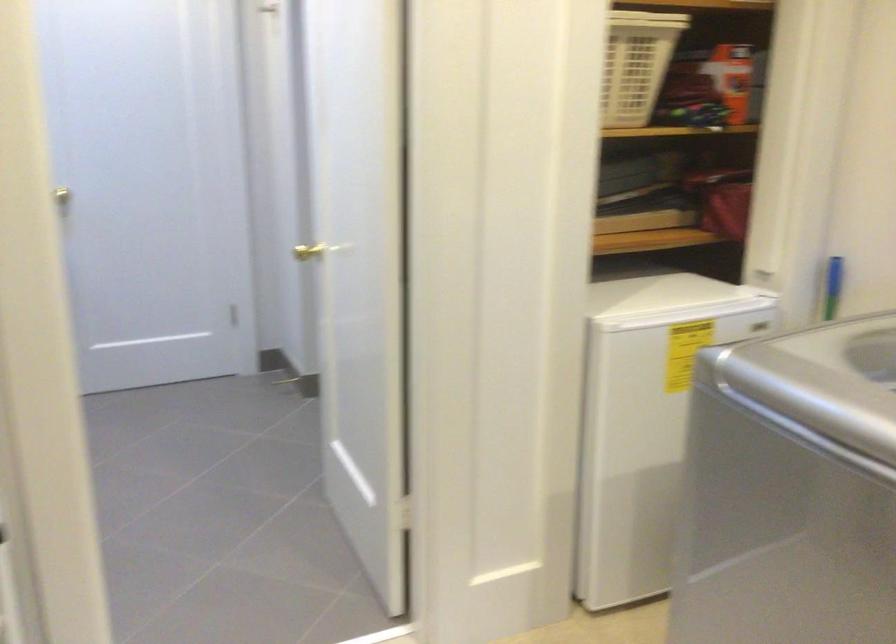
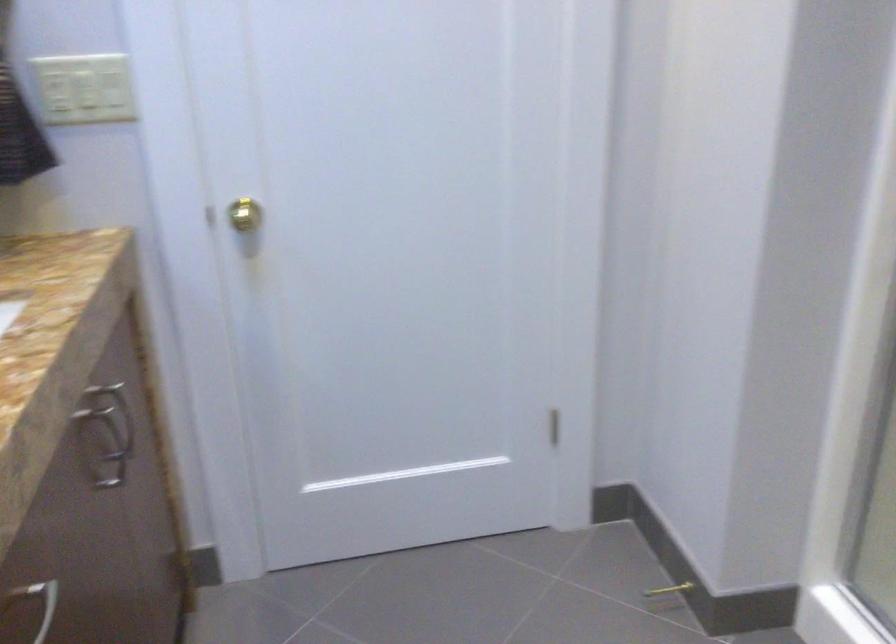
Where in the second image is the point corresponding to point (304, 389) from the first image?

(666, 596)